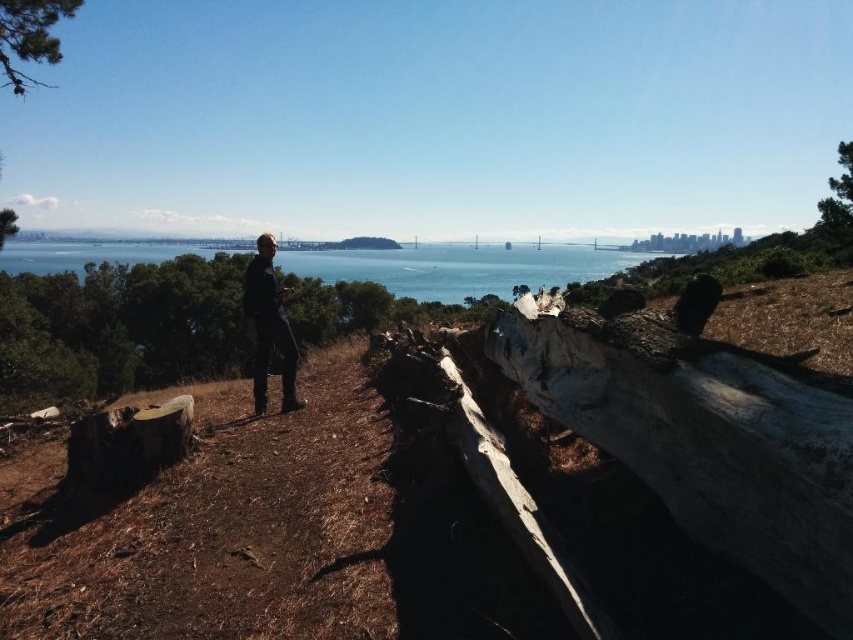
From the picture: You are standing at the center of the image and want to move towards the dark blue jeans at center. In which direction should you move?

You should move towards the center of the image where the dark blue jeans at center are located.

You are standing at the center of the image and want to locate the blue water at center. What are the coordinates where you should look?

The coordinates for the blue water at center are at point (461, 268).

You are standing at the point labeled point (849, 145) and want to walk to the point labeled point (570, 269). Given that the path is clear, will you have to go around any obstacles between these two points?

No, you won not have to go around any obstacles between the two points because the path is clear.